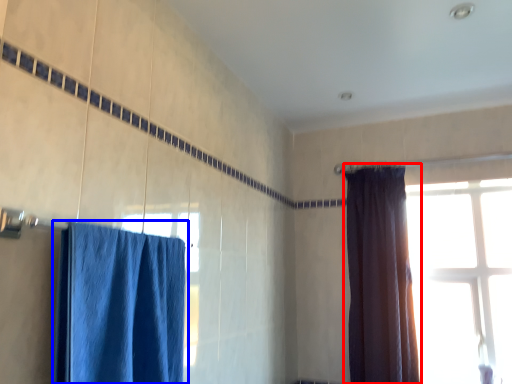
Question: Which object is closer to the camera taking this photo, curtain (highlighted by a red box) or curtain (highlighted by a blue box)?

Choices:
 (A) curtain
 (B) curtain

Answer: (B)